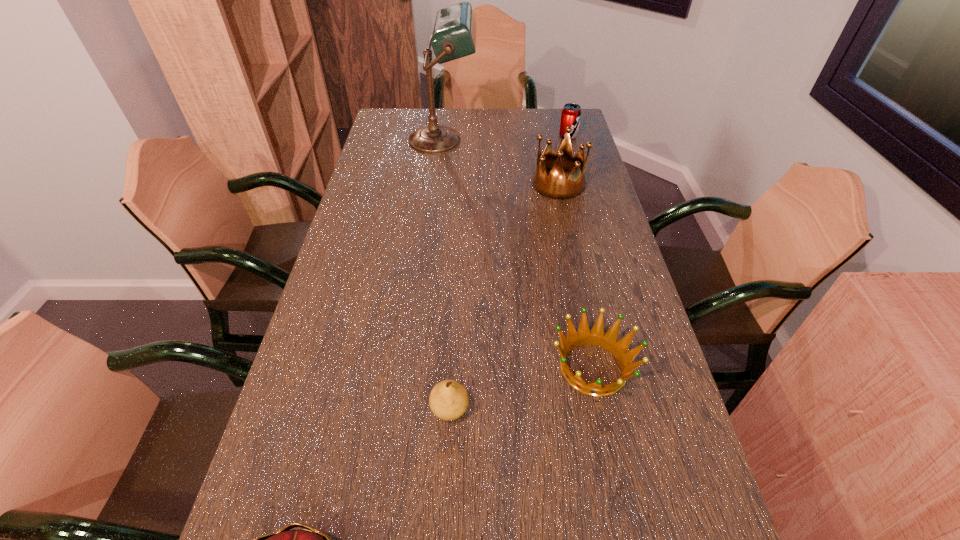
The height and width of the screenshot is (540, 960). Identify the location of vacant point located 0.230m on the front of the second farthest crown. (626, 528).

You are a GUI agent. You are given a task and a screenshot of the screen. Output one action in this format:
    pyautogui.click(x=<x>, y=<y>)
    Task: Click on the table lamp located in the far edge section of the desktop
    The height and width of the screenshot is (540, 960).
    Given the screenshot: What is the action you would take?
    pyautogui.click(x=454, y=35)

Locate an element on the screen. soda can located at the far edge is located at coordinates (571, 113).

Where is `object that is at the left edge`? object that is at the left edge is located at coordinates (454, 35).

You are a GUI agent. You are given a task and a screenshot of the screen. Output one action in this format:
    pyautogui.click(x=<x>, y=<y>)
    Task: Click on the soda can that is at the right edge
    The image size is (960, 540).
    Given the screenshot: What is the action you would take?
    [571, 113]

This screenshot has width=960, height=540. Find the location of `object located at the far left corner`. object located at the far left corner is located at coordinates (454, 35).

This screenshot has width=960, height=540. I want to click on object situated at the far right corner, so click(x=571, y=113).

Locate an element on the screen. vacant space at the far edge is located at coordinates (473, 124).

Locate an element on the screen. Image resolution: width=960 pixels, height=540 pixels. free region at the left edge of the desktop is located at coordinates (389, 262).

Find the location of a particular element. The height and width of the screenshot is (540, 960). vacant area at the right edge is located at coordinates (573, 204).